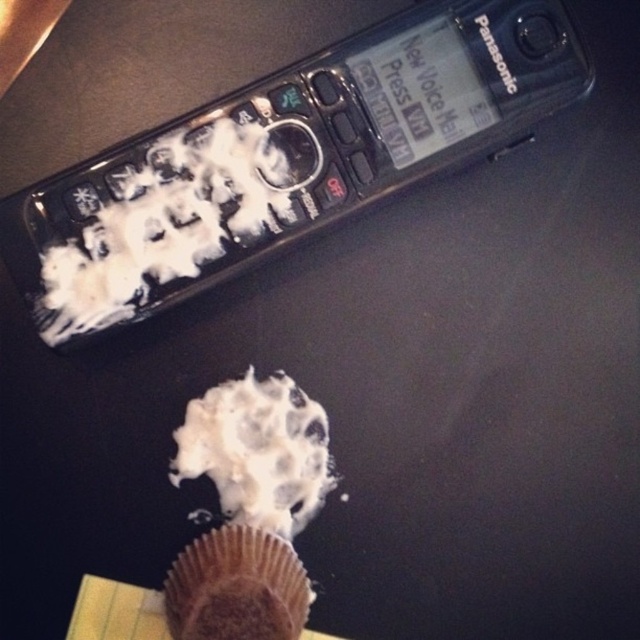
Question: Which of the following is the closest to the observer?

Choices:
 (A) (308, 502)
 (B) (280, 557)

Answer: (B)

Question: Which of the following is the closest to the observer?

Choices:
 (A) coord(179,451)
 (B) coord(208,616)

Answer: (B)

Question: Does white creamy frosting at center have a smaller size compared to brown matte muffin at lower center?

Choices:
 (A) no
 (B) yes

Answer: (A)

Question: Does white creamy frosting at center lie in front of brown matte muffin at lower center?

Choices:
 (A) no
 (B) yes

Answer: (A)

Question: Is white creamy frosting at center in front of brown matte muffin at lower center?

Choices:
 (A) yes
 (B) no

Answer: (B)